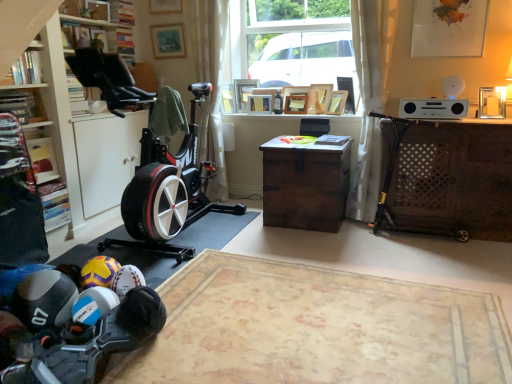
The image size is (512, 384). What are the coordinates of `matte paper picture frame at upper right, placed as the 7th picture frame when sorted from left to right` in the screenshot? It's located at (449, 28).

Image resolution: width=512 pixels, height=384 pixels. What do you see at coordinates (305, 185) in the screenshot?
I see `brown wooden desk at center, positioned as the second desk in right-to-left order` at bounding box center [305, 185].

At what (x,y) coordinates should I click in order to perform the action: click on wooden picture frame at upper center, arranged as the first picture frame when viewed from the left. Please return your answer as a coordinate pair (x, y). This screenshot has height=384, width=512. Looking at the image, I should click on (168, 41).

In order to face wooden desk at right, the second desk in the left-to-right sequence, should I rotate leftwards or rightwards?

Turn right approximately 24.396 degrees to face it.

Locate an element on the screen. The width and height of the screenshot is (512, 384). white matte cabinet at left is located at coordinates (85, 141).

Between white sheer curtain at right, which ranks as the 2th curtain in left-to-right order, and rubberized black dumbbells at lower left, which one has less height?

rubberized black dumbbells at lower left is shorter.

Is white sheer curtain at right, which ranks as the 2th curtain in left-to-right order, wider or thinner than rubberized black dumbbells at lower left?

Clearly, white sheer curtain at right, which ranks as the 2th curtain in left-to-right order, has more width compared to rubberized black dumbbells at lower left.

From a real-world perspective, is white sheer curtain at right, arranged as the first curtain when viewed from the right, physically above rubberized black dumbbells at lower left?

Correct, in the physical world, white sheer curtain at right, arranged as the first curtain when viewed from the right, is higher than rubberized black dumbbells at lower left.

Looking at this image, measure the distance from white matte baseball at lower left, which is counted as the first toy, starting from the back, to rubberized black shoe at lower left, the 1th toy when ordered from front to back.

The distance of white matte baseball at lower left, which is counted as the first toy, starting from the back, from rubberized black shoe at lower left, the 1th toy when ordered from front to back, is 4.05 inches.

Is white matte baseball at lower left, which is counted as the first toy, starting from the back, surrounding rubberized black shoe at lower left, arranged as the 2th toy when viewed from the back?

No, rubberized black shoe at lower left, arranged as the 2th toy when viewed from the back, is located outside of white matte baseball at lower left, which is counted as the first toy, starting from the back.

Is white matte baseball at lower left, which is counted as the first toy, starting from the back, positioned with its back to rubberized black shoe at lower left, the 1th toy when ordered from front to back?

That's not correct — white matte baseball at lower left, which is counted as the first toy, starting from the back, is not looking away from rubberized black shoe at lower left, the 1th toy when ordered from front to back.

The height and width of the screenshot is (384, 512). I want to click on toy in front of the white matte baseball at lower left, which is counted as the first toy, starting from the back, so click(x=93, y=305).

Find the location of a particular element. Image resolution: width=512 pixels, height=384 pixels. the 1st picture frame to the right of the white matte baseball at lower left, which is counted as the first toy, starting from the back, starting your count from the anchor is located at coordinates (244, 92).

Looking at this image, who is more distant, white matte baseball at lower left, which is counted as the first toy, starting from the back, or wooden picture frame at upper center, placed as the 2th picture frame when sorted from left to right?

wooden picture frame at upper center, placed as the 2th picture frame when sorted from left to right, is further away from the camera.

Is white matte baseball at lower left, which is counted as the first toy, starting from the back, thinner than wooden picture frame at upper center, placed as the 2th picture frame when sorted from left to right?

No.

From the image's perspective, does white matte baseball at lower left, the 2th toy when ordered from front to back, appear higher than wooden picture frame at upper center, placed as the 2th picture frame when sorted from left to right?

No, from the image's perspective, white matte baseball at lower left, the 2th toy when ordered from front to back, is not on top of wooden picture frame at upper center, placed as the 2th picture frame when sorted from left to right.

Does point (166, 56) come in front of point (291, 96)?

That is False.

Is wooden picture frame at upper center, arranged as the first picture frame when viewed from the left, placed right next to wooden picture frame at center, which appears as the fourth picture frame when viewed from the right?

No, wooden picture frame at upper center, arranged as the first picture frame when viewed from the left, is not beside wooden picture frame at center, which appears as the fourth picture frame when viewed from the right.

From the image's perspective, which one is positioned lower, wooden picture frame at upper center, the seventh picture frame from the right, or wooden picture frame at center, which appears as the fourth picture frame when viewed from the right?

wooden picture frame at center, which appears as the fourth picture frame when viewed from the right.

Is wooden picture frame at upper center, arranged as the first picture frame when viewed from the left, facing away from wooden picture frame at center, which ranks as the fourth picture frame in left-to-right order?

wooden picture frame at upper center, arranged as the first picture frame when viewed from the left, does not have its back to wooden picture frame at center, which ranks as the fourth picture frame in left-to-right order.

Does white sheer curtain at right, arranged as the first curtain when viewed from the right, lie behind beige textured rug at lower center?

Yes, white sheer curtain at right, arranged as the first curtain when viewed from the right, is further from the viewer.

From the image's perspective, between white sheer curtain at right, arranged as the first curtain when viewed from the right, and beige textured rug at lower center, who is located below?

beige textured rug at lower center is shown below in the image.

Which object is positioned more to the left, white sheer curtain at right, arranged as the first curtain when viewed from the right, or beige textured rug at lower center?

Positioned to the left is beige textured rug at lower center.

Considering the positions of point (364, 198) and point (493, 382), is point (364, 198) closer or farther from the camera than point (493, 382)?

Point (364, 198).

Is wooden desk at right, the second desk in the left-to-right sequence, thinner than wooden picture frame at upper center, which appears as the 6th picture frame when viewed from the left?

No, wooden desk at right, the second desk in the left-to-right sequence, is not thinner than wooden picture frame at upper center, which appears as the 6th picture frame when viewed from the left.

From the image's perspective, is wooden desk at right, the 1th desk in the right-to-left sequence, located beneath wooden picture frame at upper center, which appears as the 6th picture frame when viewed from the left?

Yes, from the image's perspective, wooden desk at right, the 1th desk in the right-to-left sequence, is beneath wooden picture frame at upper center, which appears as the 6th picture frame when viewed from the left.

Are wooden desk at right, the 1th desk in the right-to-left sequence, and wooden picture frame at upper center, the 2th picture frame in the right-to-left sequence, located far from each other?

Yes, wooden desk at right, the 1th desk in the right-to-left sequence, is far from wooden picture frame at upper center, the 2th picture frame in the right-to-left sequence.

Is wooden desk at right, the second desk in the left-to-right sequence, positioned beyond the bounds of wooden picture frame at upper center, which appears as the 6th picture frame when viewed from the left?

Absolutely, wooden desk at right, the second desk in the left-to-right sequence, is external to wooden picture frame at upper center, which appears as the 6th picture frame when viewed from the left.

The width and height of the screenshot is (512, 384). I want to click on desk that is the 1st one when counting downward from the white matte cabinet at left (from the image's perspective), so click(x=446, y=179).

Does wooden desk at right, the 1th desk in the right-to-left sequence, turn towards white matte cabinet at left?

No.

In terms of width, does wooden desk at right, the 1th desk in the right-to-left sequence, look wider or thinner when compared to white matte cabinet at left?

Considering their sizes, wooden desk at right, the 1th desk in the right-to-left sequence, looks slimmer than white matte cabinet at left.

The image size is (512, 384). Find the location of `stuff that appears on the left of white sheer curtain at right, arranged as the first curtain when viewed from the right`. stuff that appears on the left of white sheer curtain at right, arranged as the first curtain when viewed from the right is located at coordinates (74, 328).

Find the location of a particular element. toy below the white matte baseball at lower left, which is counted as the first toy, starting from the back (from a real-world perspective) is located at coordinates (93, 305).

Which object lies nearer to the anchor point white sheer curtain at center, the 1th curtain in the left-to-right sequence, wooden bookshelf at left, which appears as the 1th shelf when ordered from the bottom, or brown wooden desk at center, the 1th desk in the left-to-right sequence?

brown wooden desk at center, the 1th desk in the left-to-right sequence, is closer to white sheer curtain at center, the 1th curtain in the left-to-right sequence.

Looking at this image, looking at the image, which one is located further to beige textured rug at lower center, matte paper picture frame at upper right, placed as the 7th picture frame when sorted from left to right, or wooden picture frame at center, the fifth picture frame when ordered from right to left?

wooden picture frame at center, the fifth picture frame when ordered from right to left, is positioned further to the anchor beige textured rug at lower center.

Estimate the real-world distances between objects in this image. Which object is further from beige textured rug at lower center, white matte baseball at lower left, which is counted as the first toy, starting from the back, or wooden desk at right, the second desk in the left-to-right sequence?

wooden desk at right, the second desk in the left-to-right sequence.

Based on their spatial positions, is wooden picture frame at upper center, placed as the 2th picture frame when sorted from left to right, or wooden bookshelf at upper left, arranged as the 1th shelf when viewed from the top, further from wooden bookshelf at left, which appears as the 1th shelf when ordered from the bottom?

Based on the image, wooden picture frame at upper center, placed as the 2th picture frame when sorted from left to right, appears to be further to wooden bookshelf at left, which appears as the 1th shelf when ordered from the bottom.

Which object lies nearer to the anchor point wooden picture frame at upper center, the 6th picture frame in the right-to-left sequence, wooden picture frame at upper center, which appears as the 6th picture frame when viewed from the left, or wooden bookshelf at upper left, arranged as the 1th shelf when viewed from the top?

wooden picture frame at upper center, which appears as the 6th picture frame when viewed from the left.

Which object lies further to the anchor point brown wooden desk at center, positioned as the second desk in right-to-left order, matte paper picture frame at upper right, placed as the 7th picture frame when sorted from left to right, or rubberized black dumbbells at lower left?

rubberized black dumbbells at lower left lies further to brown wooden desk at center, positioned as the second desk in right-to-left order, than the other object.

Considering their positions, is wooden picture frame at center, the fifth picture frame when ordered from right to left, positioned further to wooden bookshelf at left, which is the third shelf in top-to-bottom order, than wooden picture frame at upper center, the 2th picture frame in the right-to-left sequence?

wooden picture frame at upper center, the 2th picture frame in the right-to-left sequence.

Which object lies nearer to the anchor point white matte cabinet at left, white matte baseball at lower left, the 2th toy when ordered from front to back, or wooden picture frame at center, which appears as the fourth picture frame when viewed from the right?

Among the two, white matte baseball at lower left, the 2th toy when ordered from front to back, is located nearer to white matte cabinet at left.

The height and width of the screenshot is (384, 512). Identify the location of cabinetry between rubberized black dumbbells at lower left and wooden picture frame at upper center, the 2th picture frame in the right-to-left sequence, along the z-axis. (85, 141).

Locate an element on the screen. This screenshot has width=512, height=384. curtain between wooden bookshelf at left, which is the third shelf in top-to-bottom order, and wooden picture frame at upper center, the 6th picture frame in the right-to-left sequence is located at coordinates (209, 82).

This screenshot has height=384, width=512. I want to click on doormat between white matte cabinet at left and wooden desk at right, the second desk in the left-to-right sequence, from left to right, so click(x=316, y=329).

The width and height of the screenshot is (512, 384). In order to click on desk between white sheer curtain at center, the 1th curtain in the left-to-right sequence, and white sheer curtain at right, which ranks as the 2th curtain in left-to-right order, in the horizontal direction in this screenshot , I will do `click(305, 185)`.